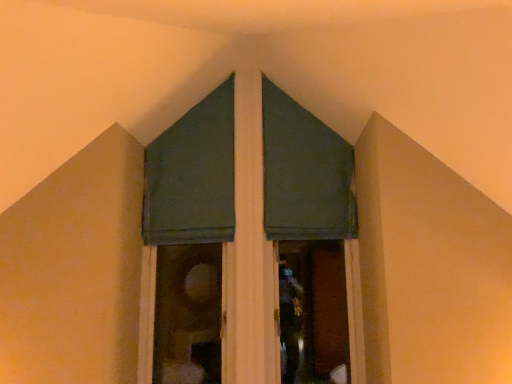
Question: Is dark green fabric at upper center, the third curtain viewed from the left, at the right side of green fabric curtain at upper center, marked as the 1th curtain in a left-to-right arrangement?

Choices:
 (A) yes
 (B) no

Answer: (A)

Question: Is dark green fabric at upper center, the third curtain viewed from the left, shorter than green fabric curtain at upper center, marked as the 1th curtain in a left-to-right arrangement?

Choices:
 (A) no
 (B) yes

Answer: (B)

Question: From a real-world perspective, is dark green fabric at upper center, the third curtain viewed from the left, positioned under green fabric curtain at upper center, marked as the 1th curtain in a left-to-right arrangement, based on gravity?

Choices:
 (A) yes
 (B) no

Answer: (A)

Question: Can you confirm if dark green fabric at upper center, which is counted as the 1th curtain, starting from the right, is wider than green fabric curtain at upper center, the 3th curtain in the right-to-left sequence?

Choices:
 (A) no
 (B) yes

Answer: (B)

Question: From the image's perspective, would you say dark green fabric at upper center, which is counted as the 1th curtain, starting from the right, is positioned over green fabric curtain at upper center, marked as the 1th curtain in a left-to-right arrangement?

Choices:
 (A) yes
 (B) no

Answer: (B)

Question: Relative to green fabric curtain at center, which ranks as the 2th curtain in left-to-right order, is dark green fabric at upper center, which is counted as the 1th curtain, starting from the right, in front or behind?

Choices:
 (A) front
 (B) behind

Answer: (B)

Question: From their relative heights in the image, would you say dark green fabric at upper center, the third curtain viewed from the left, is taller or shorter than green fabric curtain at center, placed as the second curtain when sorted from right to left?

Choices:
 (A) short
 (B) tall

Answer: (A)

Question: Is dark green fabric at upper center, the third curtain viewed from the left, to the left or to the right of green fabric curtain at center, placed as the second curtain when sorted from right to left, in the image?

Choices:
 (A) left
 (B) right

Answer: (B)

Question: Is dark green fabric at upper center, the third curtain viewed from the left, situated inside green fabric curtain at center, which ranks as the 2th curtain in left-to-right order, or outside?

Choices:
 (A) outside
 (B) inside

Answer: (B)

Question: Considering the positions of green fabric curtain at center, which ranks as the 2th curtain in left-to-right order, and dark green fabric at upper center, the third curtain viewed from the left, in the image, is green fabric curtain at center, which ranks as the 2th curtain in left-to-right order, bigger or smaller than dark green fabric at upper center, the third curtain viewed from the left,?

Choices:
 (A) small
 (B) big

Answer: (B)

Question: Is green fabric curtain at center, which ranks as the 2th curtain in left-to-right order, inside the boundaries of dark green fabric at upper center, the third curtain viewed from the left, or outside?

Choices:
 (A) outside
 (B) inside

Answer: (A)

Question: From a real-world perspective, is green fabric curtain at center, placed as the second curtain when sorted from right to left, positioned above or below dark green fabric at upper center, which is counted as the 1th curtain, starting from the right?

Choices:
 (A) above
 (B) below

Answer: (B)

Question: From the image's perspective, relative to dark green fabric at upper center, which is counted as the 1th curtain, starting from the right, is green fabric curtain at center, which ranks as the 2th curtain in left-to-right order, above or below?

Choices:
 (A) above
 (B) below

Answer: (B)

Question: From a real-world perspective, is green fabric curtain at center, placed as the second curtain when sorted from right to left, physically located above or below green fabric curtain at upper center, marked as the 1th curtain in a left-to-right arrangement?

Choices:
 (A) above
 (B) below

Answer: (B)

Question: In terms of height, does green fabric curtain at center, which ranks as the 2th curtain in left-to-right order, look taller or shorter compared to green fabric curtain at upper center, the 3th curtain in the right-to-left sequence?

Choices:
 (A) tall
 (B) short

Answer: (A)